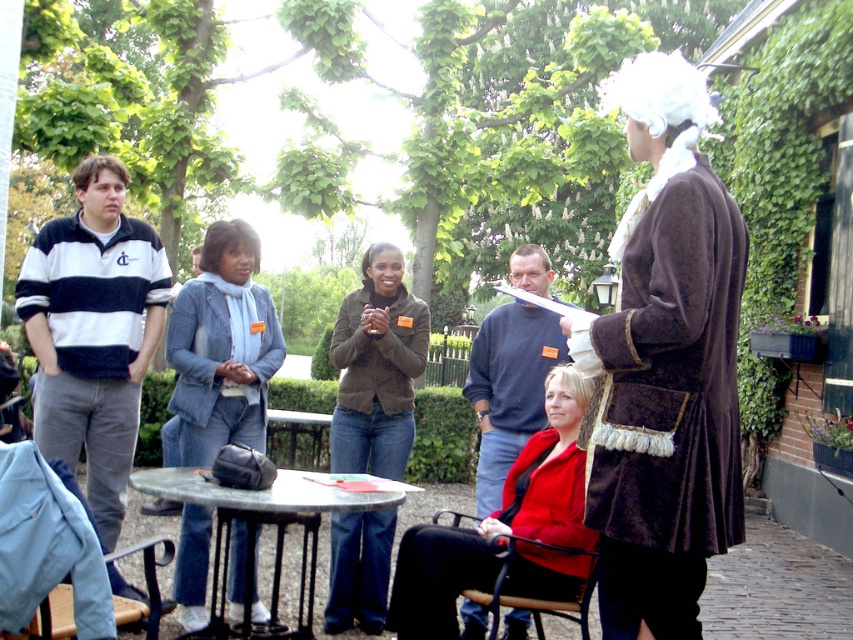
Question: Which is nearer to the denim jacket at center?

Choices:
 (A) dark gray sweater at center
 (B) brown silky wig at upper center
 (C) matte brown jacket at center

Answer: (C)

Question: Which object appears closest to the camera in this image?

Choices:
 (A) matte brown jacket at center
 (B) dark gray sweater at center

Answer: (B)

Question: Among these points, which one is nearest to the camera?

Choices:
 (A) (22, 500)
 (B) (242, 304)
 (C) (387, 241)

Answer: (A)

Question: Is light blue fabric chair at lower left bigger than dark gray sweater at center?

Choices:
 (A) yes
 (B) no

Answer: (B)

Question: Is striped cotton polo shirt at left bigger than white fuzzy wig at upper center?

Choices:
 (A) no
 (B) yes

Answer: (A)

Question: Can you confirm if brown velvet coat at right is wider than matte red coat at lower center?

Choices:
 (A) no
 (B) yes

Answer: (A)